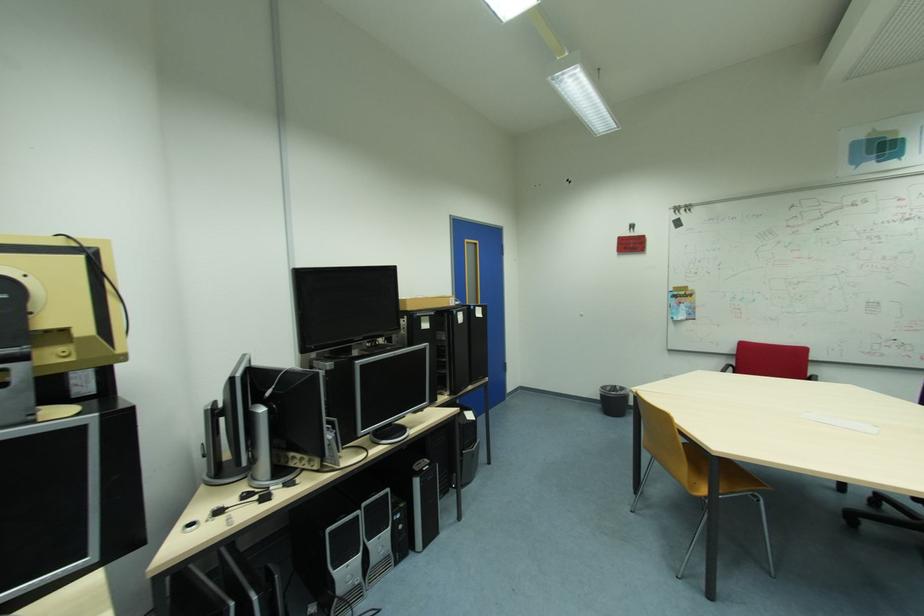
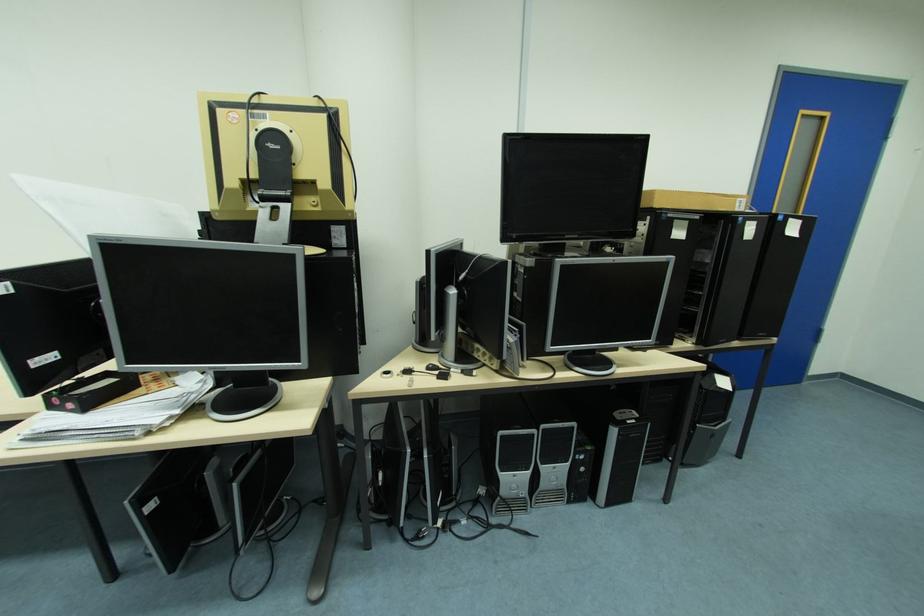
The point at (x=417, y=310) is marked in the first image. Where is the corresponding point in the second image?

(664, 206)